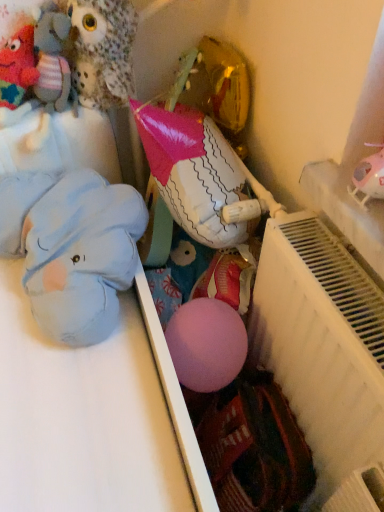
Image resolution: width=384 pixels, height=512 pixels. Describe the element at coordinates (103, 51) in the screenshot. I see `fluffy fabric owl at upper left, placed as the 1th toy when sorted from top to bottom` at that location.

Measure the distance between point (x=125, y=102) and camera.

Point (x=125, y=102) and camera are 38.94 inches apart from each other.

Image resolution: width=384 pixels, height=512 pixels. Find the location of `blue plush elephant at left, arranged as the 1th toy when ordered from the bottom`. blue plush elephant at left, arranged as the 1th toy when ordered from the bottom is located at coordinates (72, 248).

The width and height of the screenshot is (384, 512). What do you see at coordinates (193, 172) in the screenshot?
I see `white glossy balloon at center, arranged as the 2th toy when ordered from the bottom` at bounding box center [193, 172].

Locate an element on the screen. white matte radiator at right is located at coordinates (324, 356).

Considering the sizes of objects fluffy fabric owl at upper left, placed as the 1th toy when sorted from top to bottom, and blue plush elephant at left, arranged as the 1th toy when ordered from the bottom, in the image provided, who is smaller, fluffy fabric owl at upper left, placed as the 1th toy when sorted from top to bottom, or blue plush elephant at left, arranged as the 1th toy when ordered from the bottom,?

fluffy fabric owl at upper left, placed as the 1th toy when sorted from top to bottom, is smaller.

From a real-world perspective, is fluffy fabric owl at upper left, the 4th toy ordered from the bottom, positioned above or below blue plush elephant at left, which is counted as the 4th toy, starting from the top?

Clearly, from a real-world perspective, fluffy fabric owl at upper left, the 4th toy ordered from the bottom, is above blue plush elephant at left, which is counted as the 4th toy, starting from the top.

Is fluffy fabric owl at upper left, the 4th toy ordered from the bottom, further to camera compared to blue plush elephant at left, arranged as the 1th toy when ordered from the bottom?

Yes, it is behind blue plush elephant at left, arranged as the 1th toy when ordered from the bottom.

Visually, is fluffy fabric owl at upper left, placed as the 1th toy when sorted from top to bottom, positioned to the left or to the right of knitted wool toy at upper left, which appears as the third toy when ordered from the bottom?

fluffy fabric owl at upper left, placed as the 1th toy when sorted from top to bottom, is positioned on knitted wool toy at upper left, which appears as the third toy when ordered from the bottom,'s right side.

Who is taller, fluffy fabric owl at upper left, placed as the 1th toy when sorted from top to bottom, or knitted wool toy at upper left, which appears as the third toy when ordered from the bottom?

fluffy fabric owl at upper left, placed as the 1th toy when sorted from top to bottom, is taller.

Is the position of fluffy fabric owl at upper left, placed as the 1th toy when sorted from top to bottom, less distant than that of knitted wool toy at upper left, which appears as the third toy when ordered from the bottom?

Yes, fluffy fabric owl at upper left, placed as the 1th toy when sorted from top to bottom, is closer to the camera.

Which is closer, (109,36) or (18,58)?

Positioned in front is point (109,36).

Looking at their sizes, would you say knitted wool toy at upper left, which appears as the third toy when ordered from the bottom, is wider or thinner than white matte radiator at right?

knitted wool toy at upper left, which appears as the third toy when ordered from the bottom, is thinner than white matte radiator at right.

Is knitted wool toy at upper left, acting as the 2th toy starting from the top, positioned far away from white matte radiator at right?

No, there isn't a large distance between knitted wool toy at upper left, acting as the 2th toy starting from the top, and white matte radiator at right.

From the image's perspective, who appears lower, knitted wool toy at upper left, which appears as the third toy when ordered from the bottom, or white matte radiator at right?

white matte radiator at right, from the image's perspective.

Which of these two, knitted wool toy at upper left, acting as the 2th toy starting from the top, or white matte radiator at right, stands shorter?

knitted wool toy at upper left, acting as the 2th toy starting from the top, is shorter.

Does blue plush elephant at left, arranged as the 1th toy when ordered from the bottom, have a lesser height compared to white matte radiator at right?

Yes, blue plush elephant at left, arranged as the 1th toy when ordered from the bottom, is shorter than white matte radiator at right.

Which object is thinner, blue plush elephant at left, which is counted as the 4th toy, starting from the top, or white matte radiator at right?

white matte radiator at right.

Which is behind, point (86, 182) or point (369, 413)?

The point (86, 182) is behind.

How much distance is there between blue plush elephant at left, which is counted as the 4th toy, starting from the top, and white matte radiator at right?

They are 41.45 centimeters apart.

Based on their sizes in the image, would you say white glossy balloon at center, arranged as the 2th toy when ordered from the bottom, is bigger or smaller than white matte radiator at right?

In the image, white glossy balloon at center, arranged as the 2th toy when ordered from the bottom, appears to be smaller than white matte radiator at right.

Is white glossy balloon at center, which appears as the 3th toy when viewed from the top, closer to camera compared to white matte radiator at right?

No, white glossy balloon at center, which appears as the 3th toy when viewed from the top, is further to the viewer.

Is white glossy balloon at center, arranged as the 2th toy when ordered from the bottom, at the left side of white matte radiator at right?

Indeed, white glossy balloon at center, arranged as the 2th toy when ordered from the bottom, is positioned on the left side of white matte radiator at right.

From the image's perspective, relative to white matte radiator at right, is white glossy balloon at center, arranged as the 2th toy when ordered from the bottom, above or below?

white glossy balloon at center, arranged as the 2th toy when ordered from the bottom, is situated higher than white matte radiator at right in the image.

Which object is thinner, fluffy fabric owl at upper left, the 4th toy ordered from the bottom, or white glossy balloon at center, which appears as the 3th toy when viewed from the top?

fluffy fabric owl at upper left, the 4th toy ordered from the bottom.

Is fluffy fabric owl at upper left, the 4th toy ordered from the bottom, smaller than white glossy balloon at center, which appears as the 3th toy when viewed from the top?

Yes, fluffy fabric owl at upper left, the 4th toy ordered from the bottom, is smaller than white glossy balloon at center, which appears as the 3th toy when viewed from the top.

Consider the image. Would you say fluffy fabric owl at upper left, placed as the 1th toy when sorted from top to bottom, is to the left or to the right of white glossy balloon at center, arranged as the 2th toy when ordered from the bottom, in the picture?

Based on their positions, fluffy fabric owl at upper left, placed as the 1th toy when sorted from top to bottom, is located to the left of white glossy balloon at center, arranged as the 2th toy when ordered from the bottom.

Is fluffy fabric owl at upper left, placed as the 1th toy when sorted from top to bottom, behind white glossy balloon at center, which appears as the 3th toy when viewed from the top?

Yes, fluffy fabric owl at upper left, placed as the 1th toy when sorted from top to bottom, is behind white glossy balloon at center, which appears as the 3th toy when viewed from the top.

Considering the sizes of objects fluffy fabric owl at upper left, placed as the 1th toy when sorted from top to bottom, and white matte radiator at right in the image provided, who is smaller, fluffy fabric owl at upper left, placed as the 1th toy when sorted from top to bottom, or white matte radiator at right?

fluffy fabric owl at upper left, placed as the 1th toy when sorted from top to bottom.

Considering the relative positions of fluffy fabric owl at upper left, the 4th toy ordered from the bottom, and white matte radiator at right in the image provided, is fluffy fabric owl at upper left, the 4th toy ordered from the bottom, in front of white matte radiator at right?

No, the depth of fluffy fabric owl at upper left, the 4th toy ordered from the bottom, is greater than that of white matte radiator at right.

From a real-world perspective, who is located lower, fluffy fabric owl at upper left, placed as the 1th toy when sorted from top to bottom, or white matte radiator at right?

white matte radiator at right is physically lower.

Consider the image. Choose the correct answer: Is fluffy fabric owl at upper left, placed as the 1th toy when sorted from top to bottom, inside white matte radiator at right or outside it?

The correct answer is: outside.

Which toy is the 1st one when counting from the right side of the blue plush elephant at left, which is counted as the 4th toy, starting from the top? Please provide its 2D coordinates.

[(103, 51)]

From the fluffy fabric owl at upper left, the 4th toy ordered from the bottom, count the 2nd toy to the left and point to it. Please provide its 2D coordinates.

[(17, 67)]

From the image, which object appears to be nearer to white matte radiator at right, blue plush elephant at left, arranged as the 1th toy when ordered from the bottom, or knitted wool toy at upper left, acting as the 2th toy starting from the top?

The object closer to white matte radiator at right is blue plush elephant at left, arranged as the 1th toy when ordered from the bottom.

From the picture: Considering their positions, is blue plush elephant at left, arranged as the 1th toy when ordered from the bottom, positioned further to white glossy balloon at center, which appears as the 3th toy when viewed from the top, than fluffy fabric owl at upper left, the 4th toy ordered from the bottom?

fluffy fabric owl at upper left, the 4th toy ordered from the bottom.

Considering their positions, is blue plush elephant at left, arranged as the 1th toy when ordered from the bottom, positioned closer to white glossy balloon at center, which appears as the 3th toy when viewed from the top, than knitted wool toy at upper left, acting as the 2th toy starting from the top?

The object closer to white glossy balloon at center, which appears as the 3th toy when viewed from the top, is blue plush elephant at left, arranged as the 1th toy when ordered from the bottom.

From the image, which object appears to be nearer to white glossy balloon at center, arranged as the 2th toy when ordered from the bottom, knitted wool toy at upper left, which appears as the third toy when ordered from the bottom, or fluffy fabric owl at upper left, placed as the 1th toy when sorted from top to bottom?

fluffy fabric owl at upper left, placed as the 1th toy when sorted from top to bottom, lies closer to white glossy balloon at center, arranged as the 2th toy when ordered from the bottom, than the other object.

Based on their spatial positions, is white glossy balloon at center, arranged as the 2th toy when ordered from the bottom, or knitted wool toy at upper left, acting as the 2th toy starting from the top, further from blue plush elephant at left, which is counted as the 4th toy, starting from the top?

Based on the image, knitted wool toy at upper left, acting as the 2th toy starting from the top, appears to be further to blue plush elephant at left, which is counted as the 4th toy, starting from the top.

From the image, which object appears to be nearer to knitted wool toy at upper left, which appears as the third toy when ordered from the bottom, white glossy balloon at center, which appears as the 3th toy when viewed from the top, or fluffy fabric owl at upper left, the 4th toy ordered from the bottom?

Based on the image, fluffy fabric owl at upper left, the 4th toy ordered from the bottom, appears to be nearer to knitted wool toy at upper left, which appears as the third toy when ordered from the bottom.

Based on their spatial positions, is white glossy balloon at center, arranged as the 2th toy when ordered from the bottom, or white matte radiator at right closer to fluffy fabric owl at upper left, placed as the 1th toy when sorted from top to bottom?

The object closer to fluffy fabric owl at upper left, placed as the 1th toy when sorted from top to bottom, is white glossy balloon at center, arranged as the 2th toy when ordered from the bottom.

Which object lies further to the anchor point knitted wool toy at upper left, acting as the 2th toy starting from the top, white matte radiator at right or blue plush elephant at left, which is counted as the 4th toy, starting from the top?

white matte radiator at right is positioned further to the anchor knitted wool toy at upper left, acting as the 2th toy starting from the top.